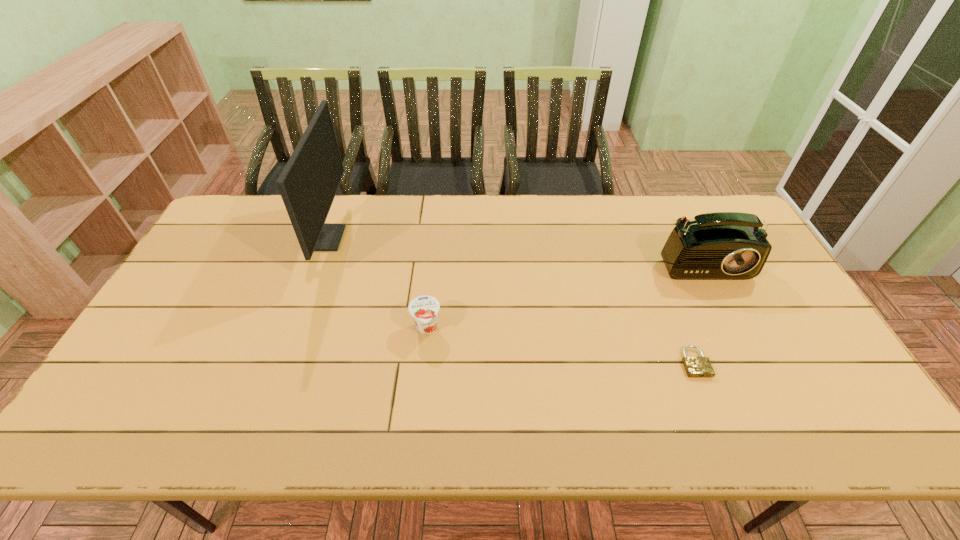
Locate which object is the closest to the second tallest object. Please provide its 2D coordinates. Your answer should be formatted as a tuple, i.e. [(x, y)], where the tuple contains the x and y coordinates of a point satisfying the conditions above.

[(696, 366)]

Find the location of a particular element. The height and width of the screenshot is (540, 960). free space that satisfies the following two spatial constraints: 1. on the front-facing side of the leftmost object; 2. on the left side of the third object from right to left is located at coordinates (292, 329).

Where is `free space in the image that satisfies the following two spatial constraints: 1. on the back side of the yogurt; 2. on the front-facing side of the computer monitor`? free space in the image that satisfies the following two spatial constraints: 1. on the back side of the yogurt; 2. on the front-facing side of the computer monitor is located at coordinates (436, 239).